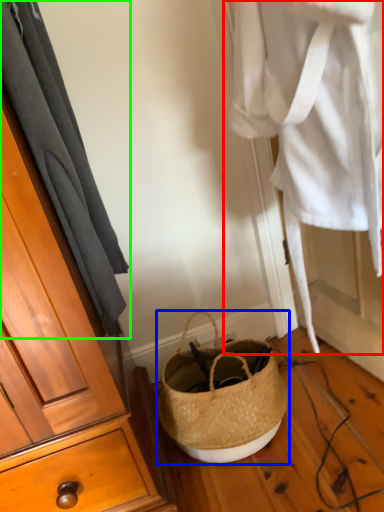
Question: Which is nearer to the clothing (highlighted by a red box)? handbag (highlighted by a blue box) or curtain (highlighted by a green box).

Choices:
 (A) handbag
 (B) curtain

Answer: (B)